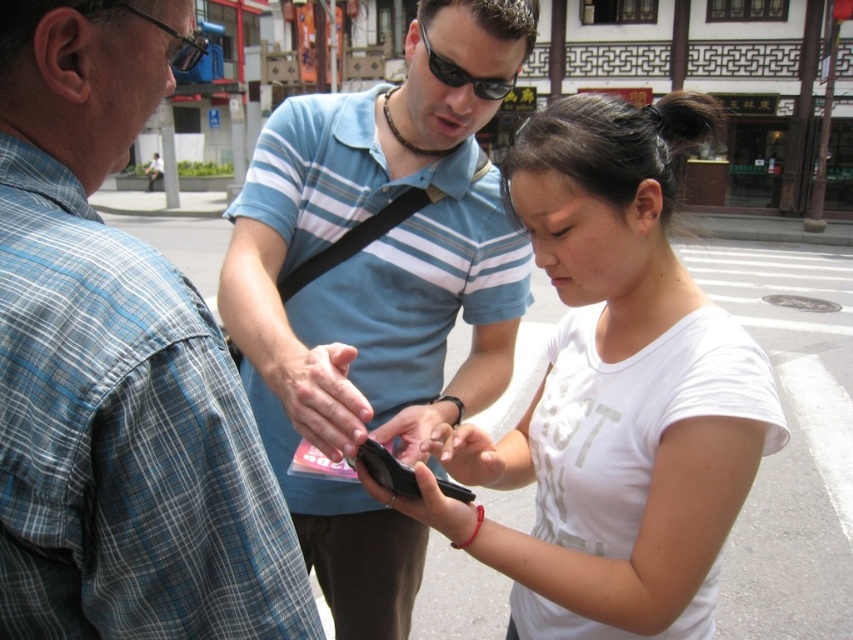
You are a fashion designer looking to create a new line of eyewear. You observe the sunglasses at center and the black plastic goggles at upper left in the scene. Which of these items is smaller in size?

The sunglasses at center has a smaller size compared to black plastic goggles at upper left.

From the picture: You are a photographer trying to capture a group photo of the blue plaid shirt at left and the blue striped shirt at center. Since you want to ensure both are fully visible in the photo, which one should you position closer to the camera?

The blue plaid shirt at left is in front of the blue striped shirt at center, so positioning the blue plaid shirt at left closer to the camera will ensure both are fully visible.

You are a photographer positioned behind the group to take a photo. The blue plaid shirt at left and the black matte smartphone at center are both in your frame. Which object should you focus on first to ensure both are in sharp focus?

The blue plaid shirt at left is closer to the viewer than the black matte smartphone at center, so you should focus on the blue plaid shirt at left first to ensure both are in sharp focus.